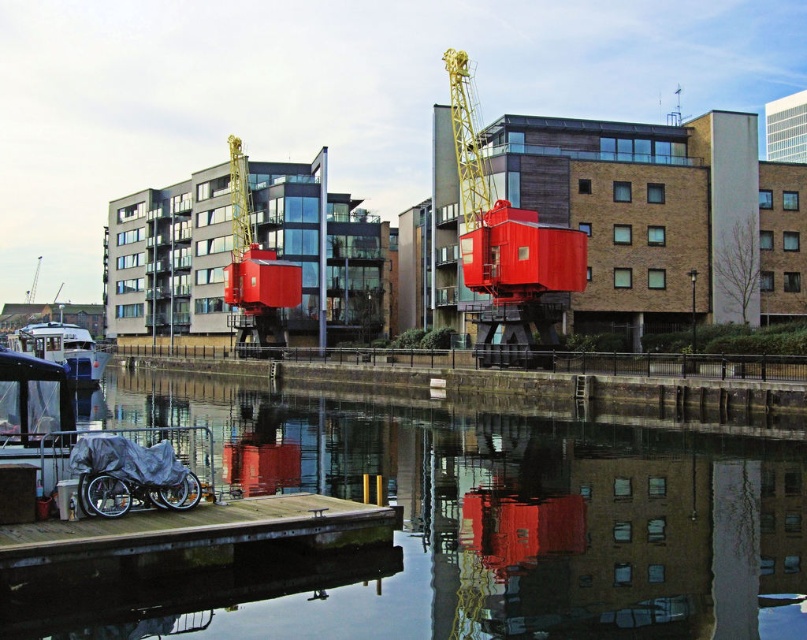
You are standing on the smooth concrete dock at center and want to reach the white glossy boat at lower left. Which direction should you walk to get closer to the boat?

Since the smooth concrete dock at center is further to the viewer than the white glossy boat at lower left, you should walk forward towards the boat to get closer.

You are standing on the wooden dock at lower left and want to get to the white glossy boat at lower left. Which direction should you go to reach the boat?

The wooden dock at lower left is positioned on the right side of white glossy boat at lower left, so you should go to the left to reach the boat.

You are a delivery person needing to place a large package on the smooth concrete dock at center. However, the dock is currently occupied by the white glossy boat at lower left. Can the package be placed on the dock without moving the boat?

The smooth concrete dock at center has a smaller size compared to white glossy boat at lower left, so the dock may not have enough space to accommodate both the boat and the large package. Moving the boat might be necessary to place the package.